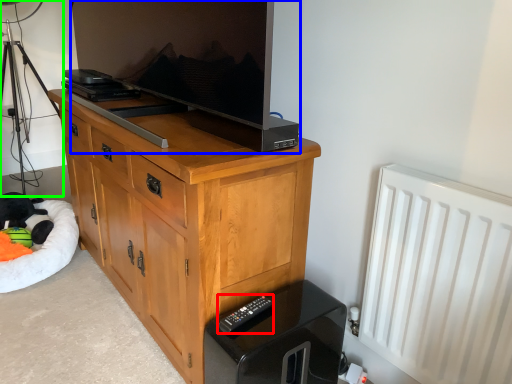
Question: Considering the real-world distances, which object is closest to remote (highlighted by a red box)? television (highlighted by a blue box) or tripod (highlighted by a green box).

Choices:
 (A) television
 (B) tripod

Answer: (A)